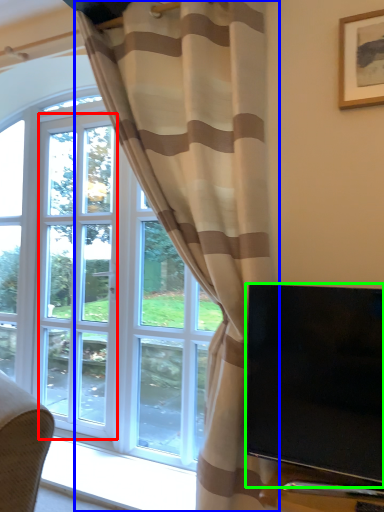
Question: Considering the real-world distances, which object is farthest from screen door (highlighted by a red box)? curtain (highlighted by a blue box) or television (highlighted by a green box)?

Choices:
 (A) curtain
 (B) television

Answer: (B)